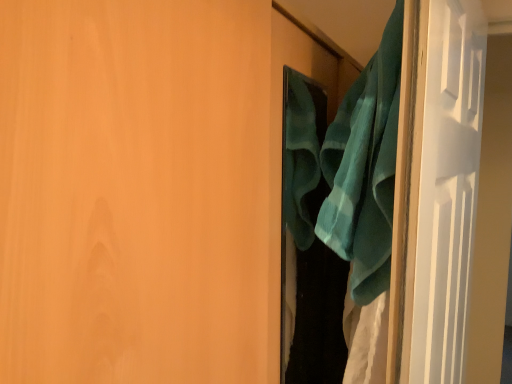
Question: From the image's perspective, is teal fabric at right positioned above or below teal fabric at right?

Choices:
 (A) above
 (B) below

Answer: (A)

Question: Choose the correct answer: Is teal fabric at right inside teal fabric at right or outside it?

Choices:
 (A) inside
 (B) outside

Answer: (B)

Question: Which object is positioned farthest from the teal fabric at right?

Choices:
 (A) teal soft towel at right
 (B) teal fabric at right

Answer: (B)

Question: Considering the real-world distances, which object is farthest from the teal soft towel at right?

Choices:
 (A) teal fabric at right
 (B) teal fabric at right

Answer: (B)